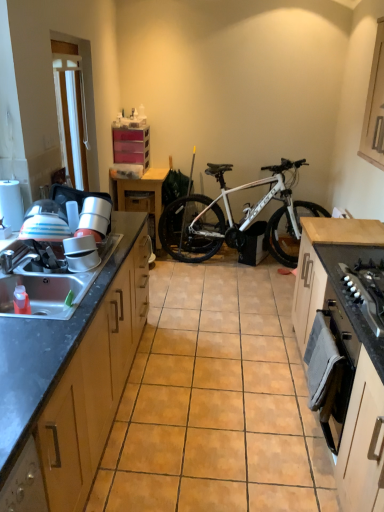
Locate an element on the screen. Image resolution: width=384 pixels, height=512 pixels. free space that is to the left of white matte oven at right, placed as the 2th cabinetry when sorted from right to left is located at coordinates (264, 444).